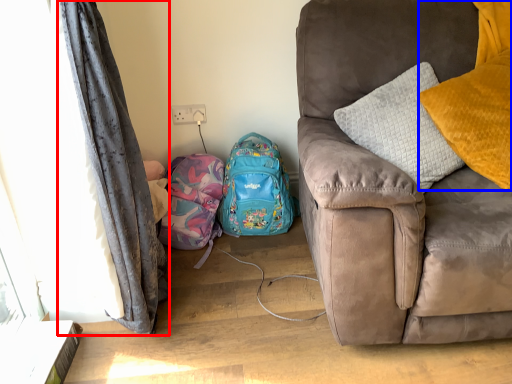
Question: Which point is closer to the camera, curtain (highlighted by a red box) or pillow (highlighted by a blue box)?

Choices:
 (A) curtain
 (B) pillow

Answer: (A)